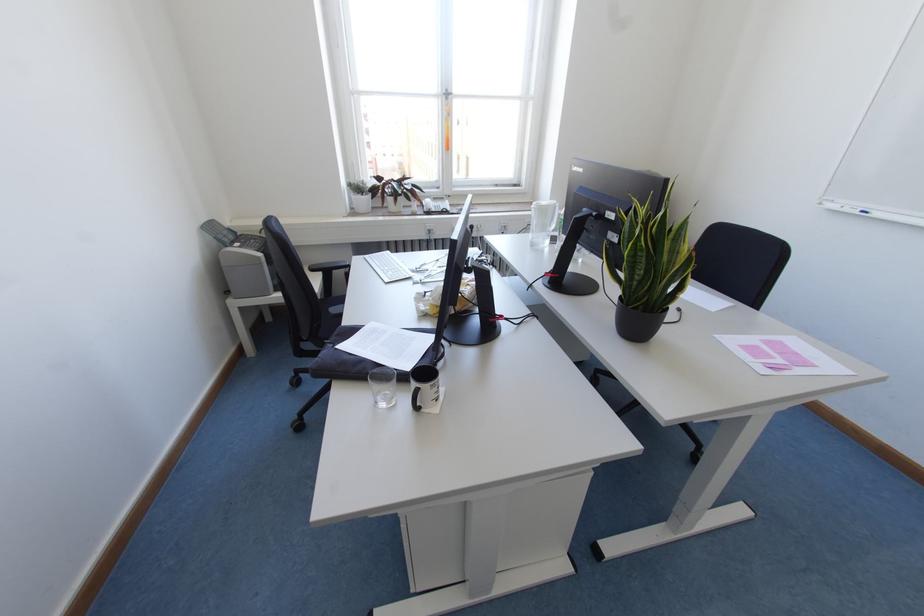
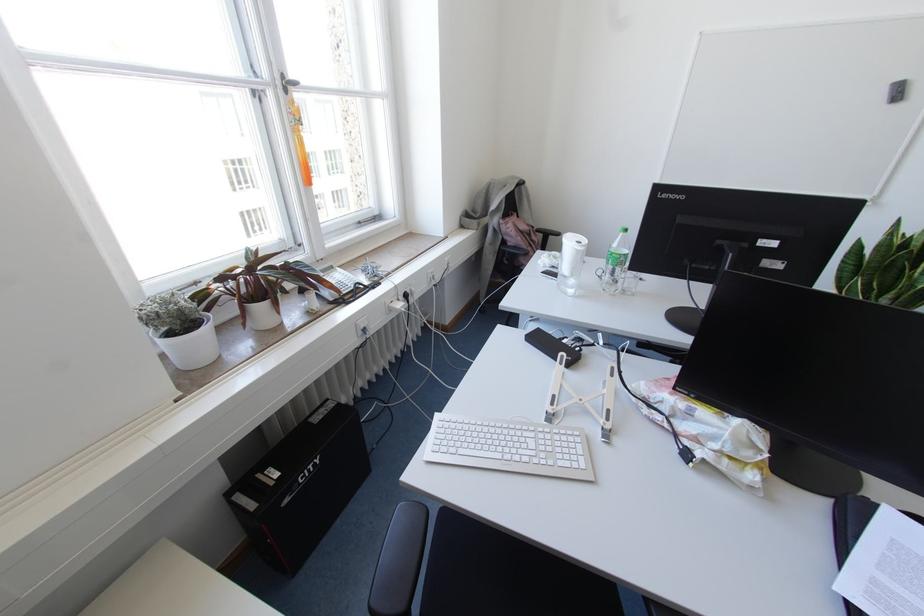
The point at [365,184] is marked in the first image. Where is the corresponding point in the second image?

(186, 298)